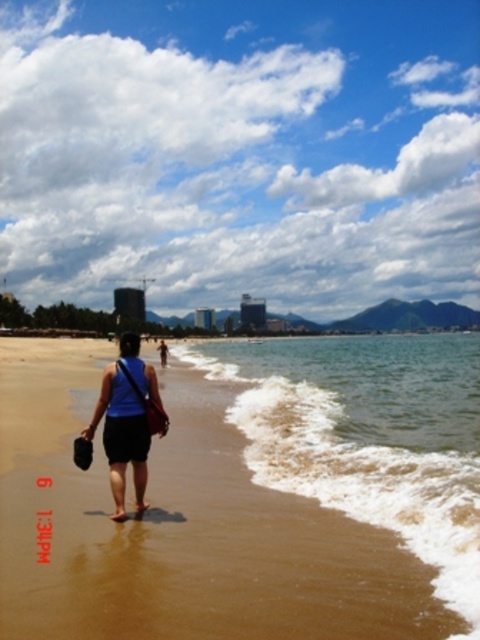
Does brown sandy water at lower right have a larger size compared to blue fabric bag at center?

Yes, brown sandy water at lower right is bigger than blue fabric bag at center.

Between brown sandy water at lower right and blue fabric bag at center, which one appears on the left side from the viewer's perspective?

blue fabric bag at center

Which is in front, point (394, 420) or point (144, 374)?

Point (144, 374) is more forward.

Where is `brown sandy water at lower right`? brown sandy water at lower right is located at coordinates (370, 436).